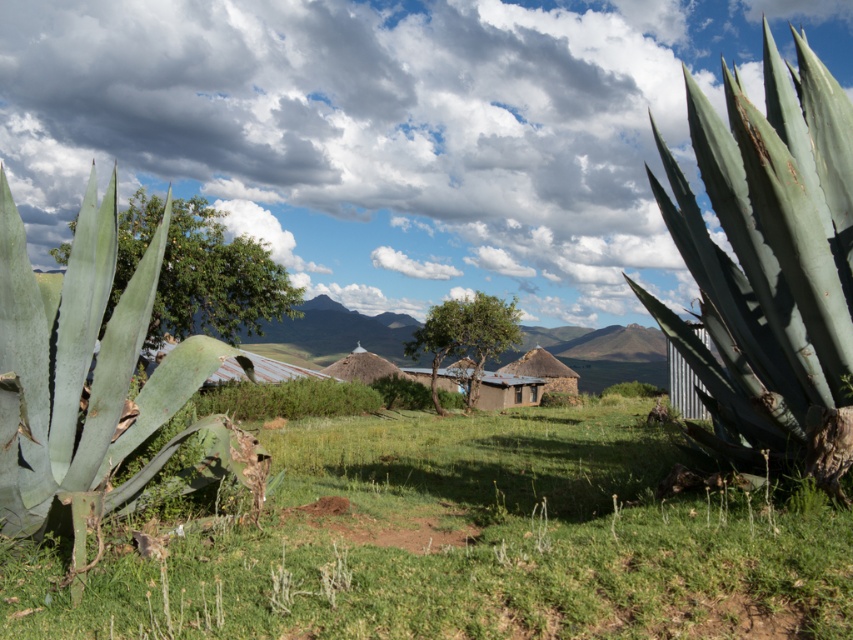
Is point (775, 328) less distant than point (244, 307)?

Yes, point (775, 328) is in front of point (244, 307).

Measure the distance between point (688,90) and camera.

Point (688,90) and camera are 17.49 feet apart.

What are the coordinates of `green succulent at center` in the screenshot? It's located at (769, 266).

Can you confirm if green grassy at center is thinner than green leafy tree at center?

Yes, green grassy at center is thinner than green leafy tree at center.

Image resolution: width=853 pixels, height=640 pixels. In order to click on green grassy at center in this screenshot , I will do (462, 544).

Identify the location of green succulent at left. The height and width of the screenshot is (640, 853). (91, 378).

Can you confirm if green succulent at left is positioned above green leafy tree at center?

Incorrect, green succulent at left is not positioned above green leafy tree at center.

The height and width of the screenshot is (640, 853). Describe the element at coordinates (91, 378) in the screenshot. I see `green succulent at left` at that location.

Locate an element on the screen. This screenshot has width=853, height=640. green succulent at left is located at coordinates (91, 378).